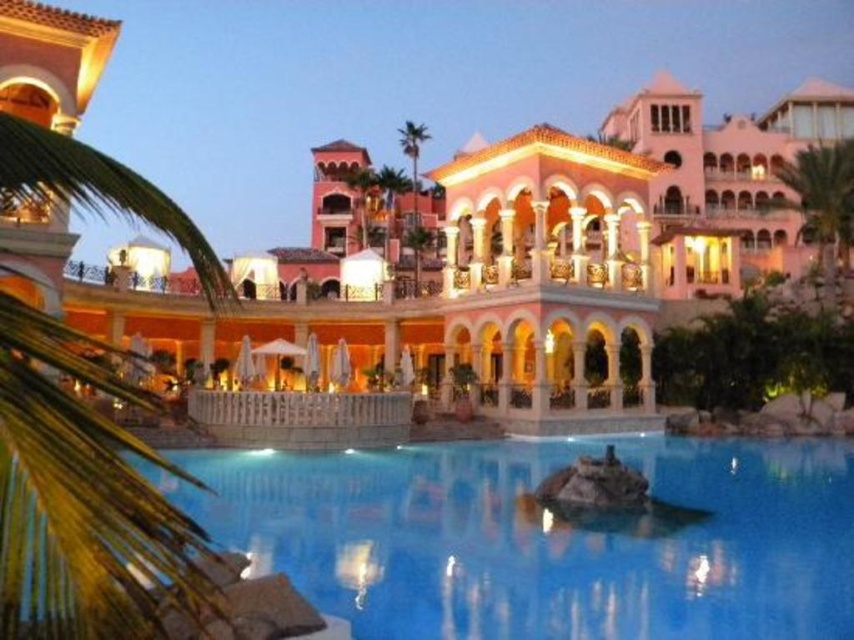
Is clear glass pool at center in front of green leafy palm tree at center?

Yes.

Between point (221, 484) and point (417, 147), which one is positioned behind?

The point (417, 147) is behind.

I want to click on clear glass pool at center, so click(545, 538).

Looking at this image, can you confirm if green leafy palm tree at upper right is positioned below green leafy palm tree at center?

Yes, green leafy palm tree at upper right is below green leafy palm tree at center.

Does green leafy palm tree at upper right appear on the right side of green leafy palm tree at center?

Correct, you'll find green leafy palm tree at upper right to the right of green leafy palm tree at center.

Which is behind, point (812, 179) or point (417, 145)?

The point (417, 145) is behind.

The height and width of the screenshot is (640, 854). I want to click on green leafy palm tree at upper right, so click(x=822, y=198).

Which is behind, point (840, 474) or point (841, 180)?

The point (841, 180) is more distant.

Does clear glass pool at center have a lesser height compared to green leafy palm tree at upper right?

Indeed, clear glass pool at center has a lesser height compared to green leafy palm tree at upper right.

What do you see at coordinates (545, 538) in the screenshot? I see `clear glass pool at center` at bounding box center [545, 538].

Where is `clear glass pool at center`? clear glass pool at center is located at coordinates (545, 538).